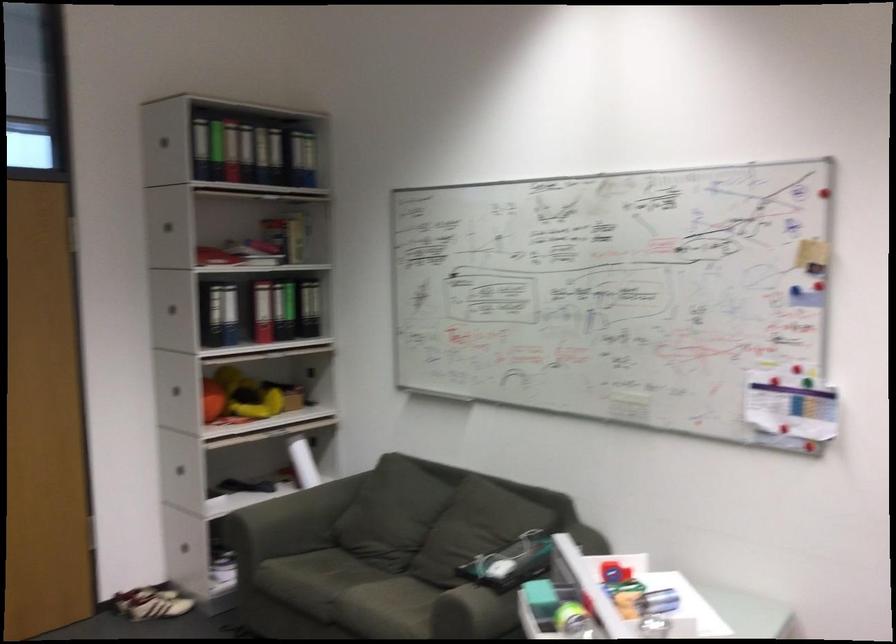
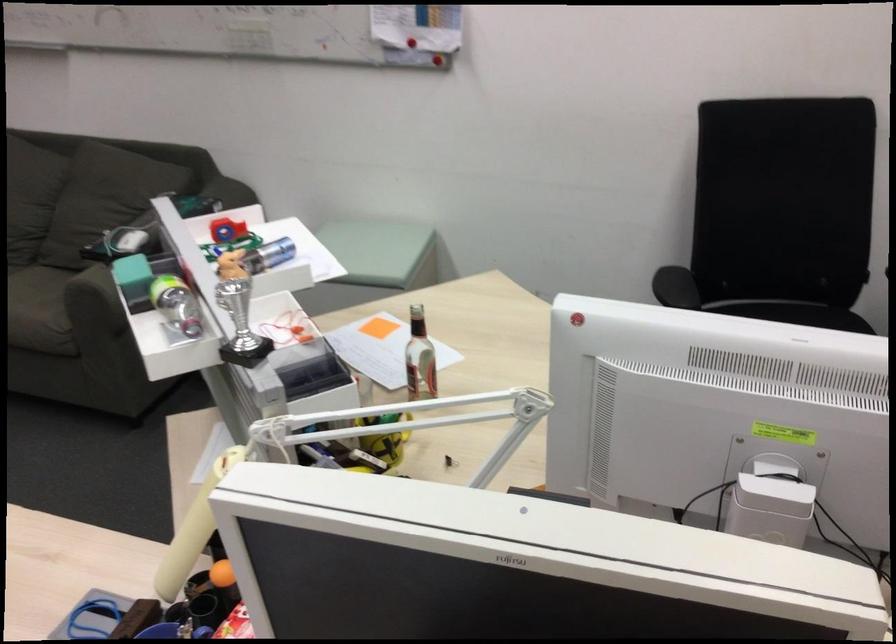
In the second image, find the point that corresponds to the point at 762,439 in the first image.

(409, 59)